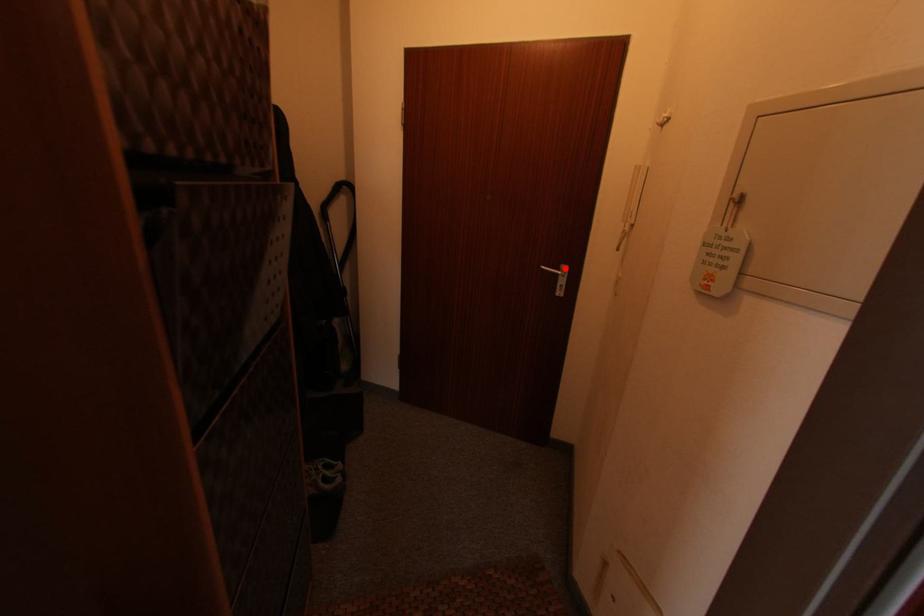
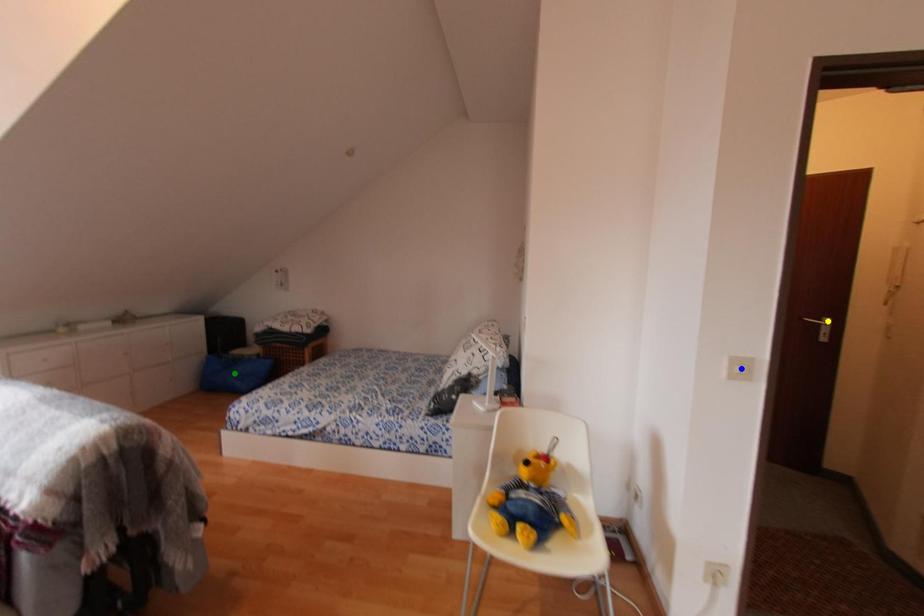
Question: I am providing you with two images of the same scene from different viewpoints. A red point is marked on the first image. You are given multiple points on the second image. Which mark in image 2 goes with the point in image 1?

Choices:
 (A) blue point
 (B) green point
 (C) yellow point

Answer: (C)